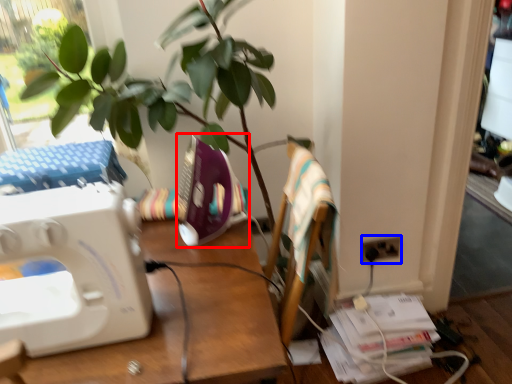
Question: Which object is further to the camera taking this photo, sewing machine (highlighted by a red box) or electric outlet (highlighted by a blue box)?

Choices:
 (A) sewing machine
 (B) electric outlet

Answer: (B)